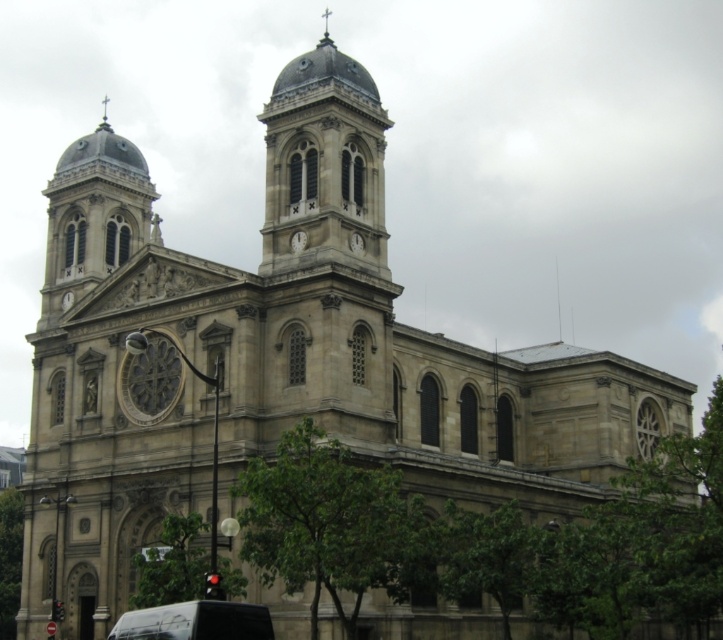
Question: Estimate the real-world distances between objects in this image. Which object is farther from the white stone clock at center?

Choices:
 (A) stone dome at center
 (B) smooth stone clock tower at center
 (C) matte gray clock at upper center

Answer: (A)

Question: Is stone dome at center above matte gray clock at upper center?

Choices:
 (A) yes
 (B) no

Answer: (A)

Question: Can you confirm if stone dome at center is positioned to the left of black matte van at lower center?

Choices:
 (A) yes
 (B) no

Answer: (A)

Question: Among these points, which one is farthest from the camera?

Choices:
 (A) (296, 236)
 (B) (140, 627)

Answer: (A)

Question: Does smooth stone clock tower at center appear under matte gray clock at upper center?

Choices:
 (A) no
 (B) yes

Answer: (A)

Question: Which of the following is the farthest from the observer?

Choices:
 (A) (81, 141)
 (B) (356, 236)
 (C) (116, 630)
 (D) (325, 29)

Answer: (A)